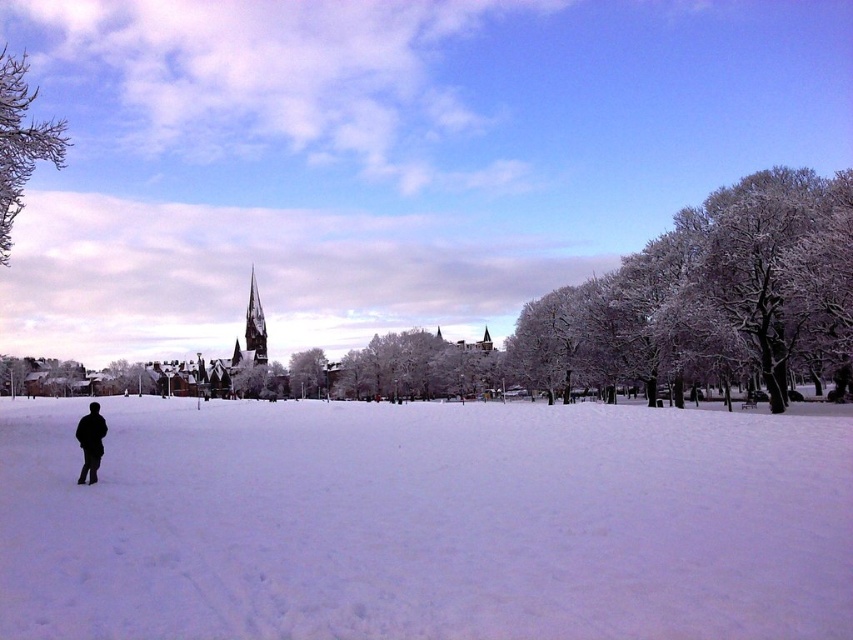
Describe the element at coordinates (21, 141) in the screenshot. I see `frosty white branches at upper left` at that location.

Between point (54, 145) and point (97, 452), which one is positioned in front?

Point (97, 452)

Where is `frosty white branches at upper left`? Image resolution: width=853 pixels, height=640 pixels. frosty white branches at upper left is located at coordinates (21, 141).

Can you confirm if black matte jacket at lower left is bigger than dark brown wooden spire at center?

No, black matte jacket at lower left is not bigger than dark brown wooden spire at center.

Who is taller, black matte jacket at lower left or dark brown wooden spire at center?

Standing taller between the two is dark brown wooden spire at center.

Is point (94, 438) more distant than point (263, 324)?

That is False.

Identify the location of black matte jacket at lower left. 90,442.

Which is more to the left, white fluffy snow at center or black matte jacket at lower left?

black matte jacket at lower left

Does point (289, 525) come closer to viewer compared to point (90, 420)?

Yes, point (289, 525) is in front of point (90, 420).

Who is more distant from viewer, (x=512, y=472) or (x=82, y=436)?

The point (x=512, y=472) is more distant.

Locate an element on the screen. The height and width of the screenshot is (640, 853). white fluffy snow at center is located at coordinates (424, 522).